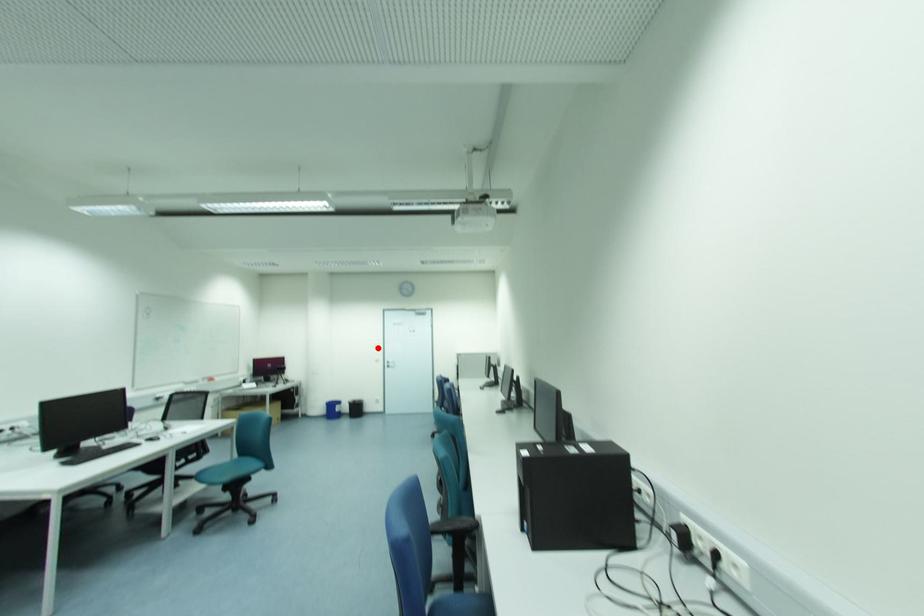
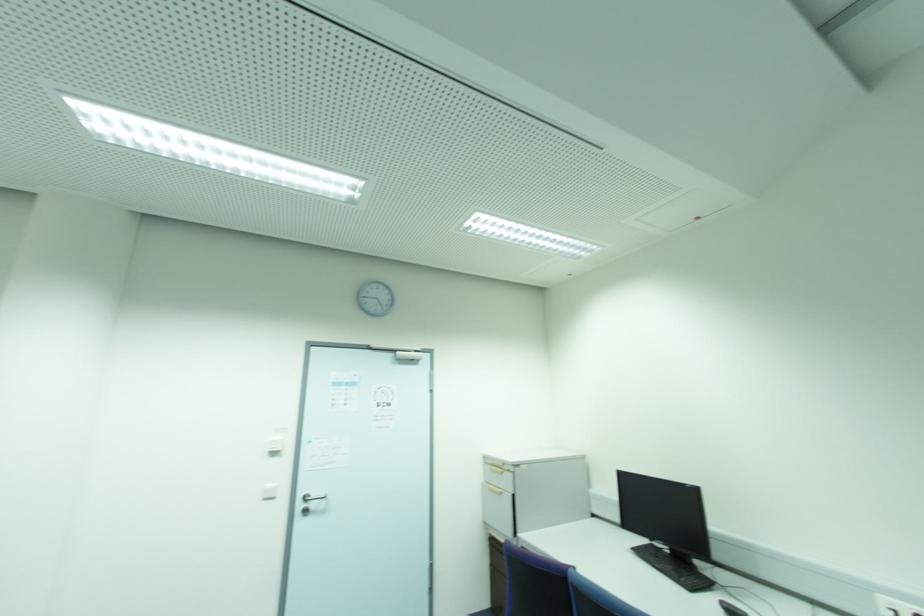
In the second image, find the point that corresponds to the highlighted location in the first image.

(274, 454)